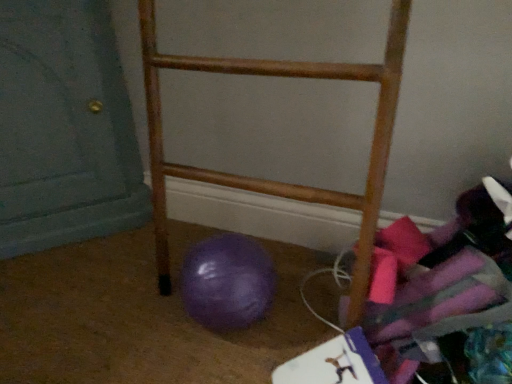
Find the location of a particular element. vacant location below matte teal door at lower left (from a real-world perspective) is located at coordinates (59, 255).